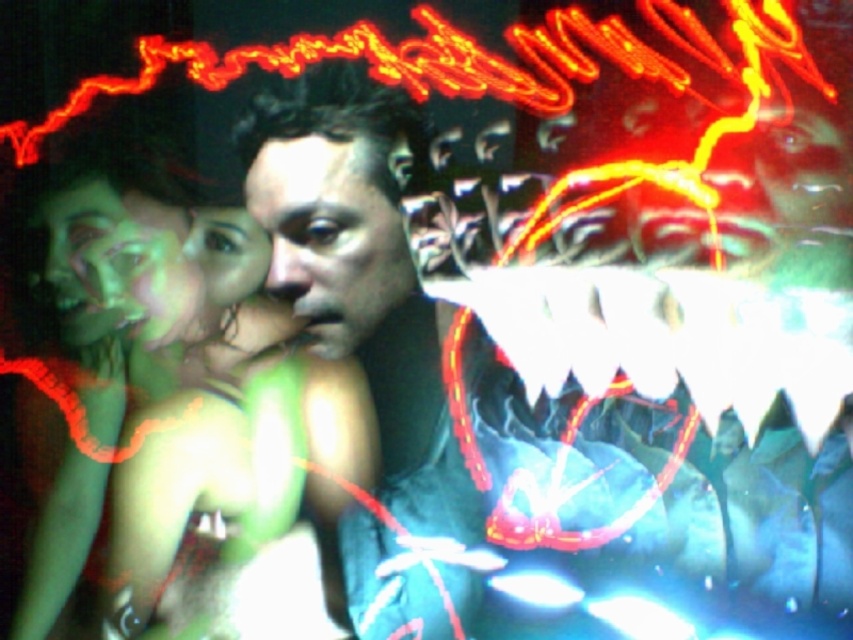
You are a photographer trying to capture a portrait of the smooth skin face at center and the green matte face at upper left. If your camera has a depth of field that can focus on objects within 15 centimeters of each other, will both faces be in focus?

The smooth skin face at center is 16.06 centimeters away from the green matte face at upper left. Since the distance between them exceeds the 15 centimeter limit, the camera cannot keep both faces in focus simultaneously.

You are observing a digital artwork with two faces. The smooth skin face at center and the green matte face at upper left. Which face is located to the right of the other?

The smooth skin face at center is positioned on the right side of green matte face at upper left.